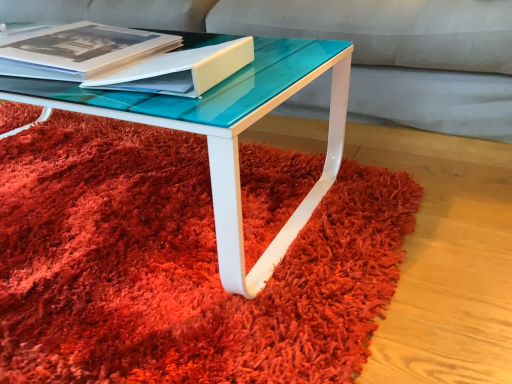
Question: Is shaggy red carpet at center bigger or smaller than matte white book at center?

Choices:
 (A) big
 (B) small

Answer: (A)

Question: Is shaggy red carpet at center in front of or behind matte white book at center in the image?

Choices:
 (A) front
 (B) behind

Answer: (A)

Question: Estimate the real-world distances between objects in this image. Which object is farther from the matte black book at upper left?

Choices:
 (A) shaggy red carpet at center
 (B) matte white book at center

Answer: (A)

Question: Which object is positioned closest to the matte black book at upper left?

Choices:
 (A) matte white book at center
 (B) shaggy red carpet at center

Answer: (A)